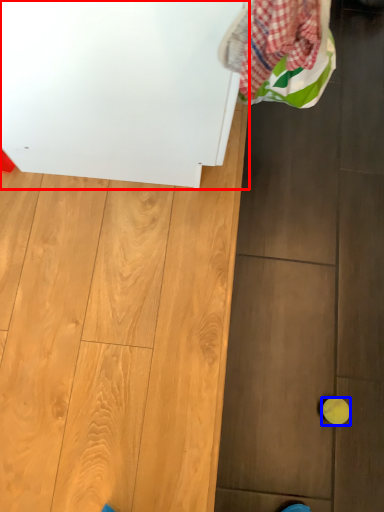
Question: Which point is closer to the camera, appliance (highlighted by a red box) or ball (highlighted by a blue box)?

Choices:
 (A) appliance
 (B) ball

Answer: (A)